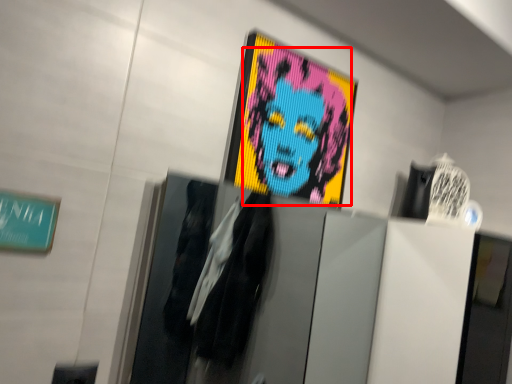
Question: Observing the image, what is the correct spatial positioning of person (annotated by the red box) in reference to poster?

Choices:
 (A) right
 (B) left

Answer: (A)